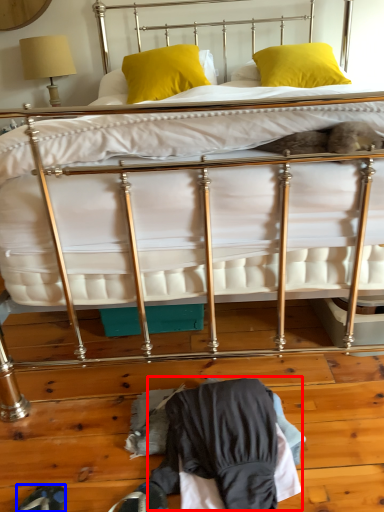
Question: Which object appears farthest to the camera in this image, clothing (highlighted by a red box) or footwear (highlighted by a blue box)?

Choices:
 (A) clothing
 (B) footwear

Answer: (A)